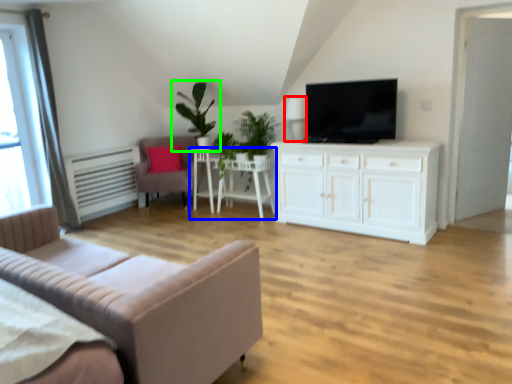
Question: Based on their relative distances, which object is nearer to lamp (highlighted by a red box)? Choose from table (highlighted by a blue box) and houseplant (highlighted by a green box).

Choices:
 (A) table
 (B) houseplant

Answer: (A)